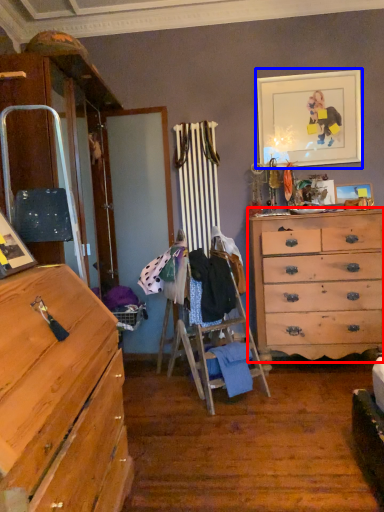
Question: Which point is further to the camera, chest of drawers (highlighted by a red box) or picture frame (highlighted by a blue box)?

Choices:
 (A) chest of drawers
 (B) picture frame

Answer: (B)